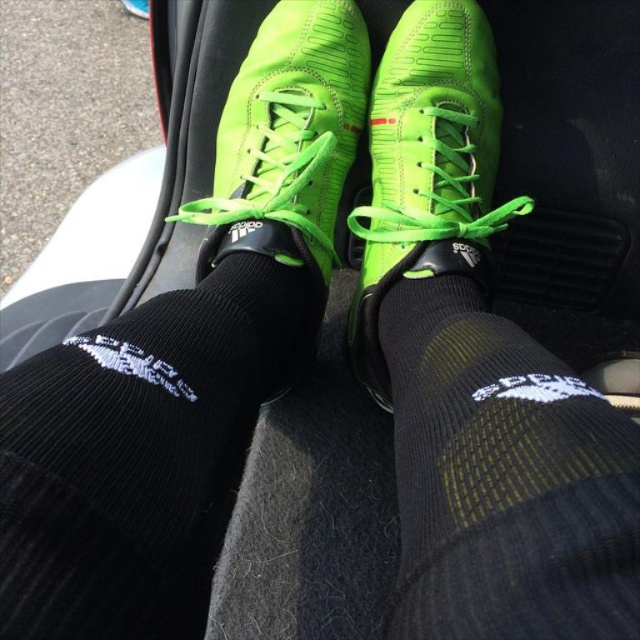
Question: Which object is closer to the camera taking this photo?

Choices:
 (A) neon green leather shoe at center
 (B) neon green suede shoe at center
 (C) black textured sock at center
 (D) black ribbed sock at center

Answer: (C)

Question: Does black ribbed sock at center appear over black textured sock at center?

Choices:
 (A) yes
 (B) no

Answer: (B)

Question: Which of the following is the farthest from the observer?

Choices:
 (A) black textured sock at center
 (B) neon green leather shoe at center
 (C) black ribbed sock at center
 (D) neon green suede shoe at center

Answer: (B)

Question: Which object appears farthest from the camera in this image?

Choices:
 (A) black textured sock at center
 (B) neon green suede shoe at center
 (C) neon green leather shoe at center
 (D) black ribbed sock at center

Answer: (C)

Question: Is the position of black ribbed sock at center less distant than that of black textured sock at center?

Choices:
 (A) yes
 (B) no

Answer: (B)

Question: Is black ribbed sock at center further to camera compared to neon green leather shoe at center?

Choices:
 (A) no
 (B) yes

Answer: (A)